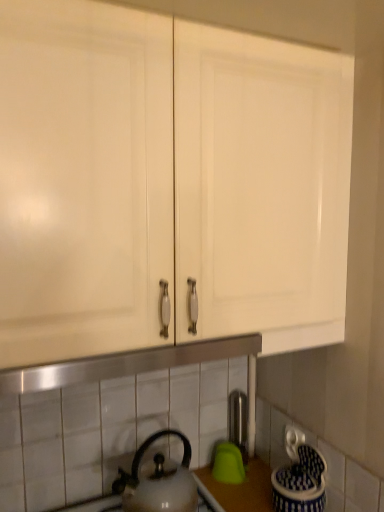
Question: Considering the positions of point (208, 300) and point (160, 507), is point (208, 300) closer or farther from the camera than point (160, 507)?

Choices:
 (A) closer
 (B) farther

Answer: (A)

Question: Is white glossy cabinet doors at upper center bigger or smaller than white glossy kettle at lower center?

Choices:
 (A) small
 (B) big

Answer: (B)

Question: Based on their relative distances, which object is nearer to the white glossy kettle at lower center?

Choices:
 (A) satin nickel faucet at center
 (B) white glossy cabinet doors at upper center

Answer: (A)

Question: Which of these objects is positioned farthest from the satin nickel faucet at center?

Choices:
 (A) white glossy cabinet doors at upper center
 (B) white glossy kettle at lower center

Answer: (A)